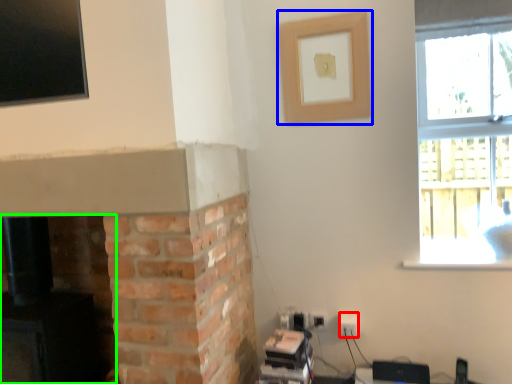
Question: Based on their relative distances, which object is nearer to electric outlet (highlighted by a red box)? Choose from picture frame (highlighted by a blue box) and fireplace (highlighted by a green box).

Choices:
 (A) picture frame
 (B) fireplace

Answer: (A)